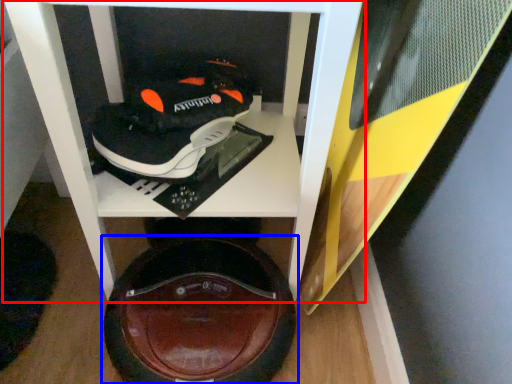
Question: Which object appears farthest to the camera in this image, furniture (highlighted by a red box) or footwear (highlighted by a blue box)?

Choices:
 (A) furniture
 (B) footwear

Answer: (B)